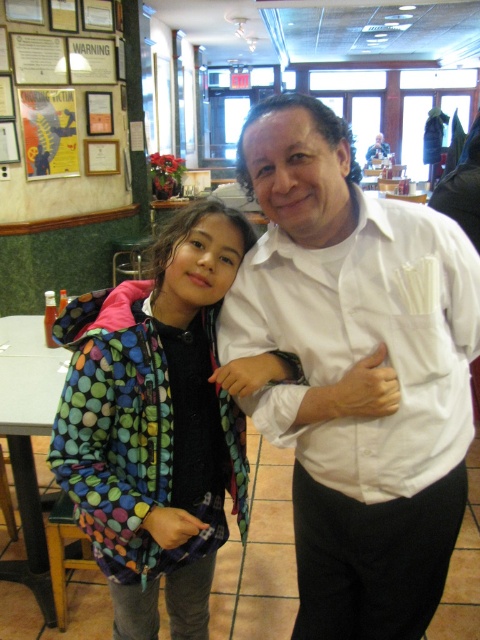
You are standing at the entrance of the diner and want to take a photo of the polka dot jacket at center. Where should you position yourself to capture it in the frame?

To capture the polka dot jacket at center in the frame, position yourself so that the jacket is centered at coordinates approximately 0.667 on the horizontal axis and 0.325 on the vertical axis relative to the image.

You are a photographer taking a picture of the scene. You notice the white smooth shirt at center and the polka dot jacket at center. Which one appears closer to the camera?

The white smooth shirt at center is closer to the viewer than the polka dot jacket at center, so it will appear closer to the camera.

The man is wearing a white glossy shirt at center, and the girl is wearing a polka dot jacket at center. Which clothing item is taller?

The polka dot jacket at center is taller than the white glossy shirt at center.